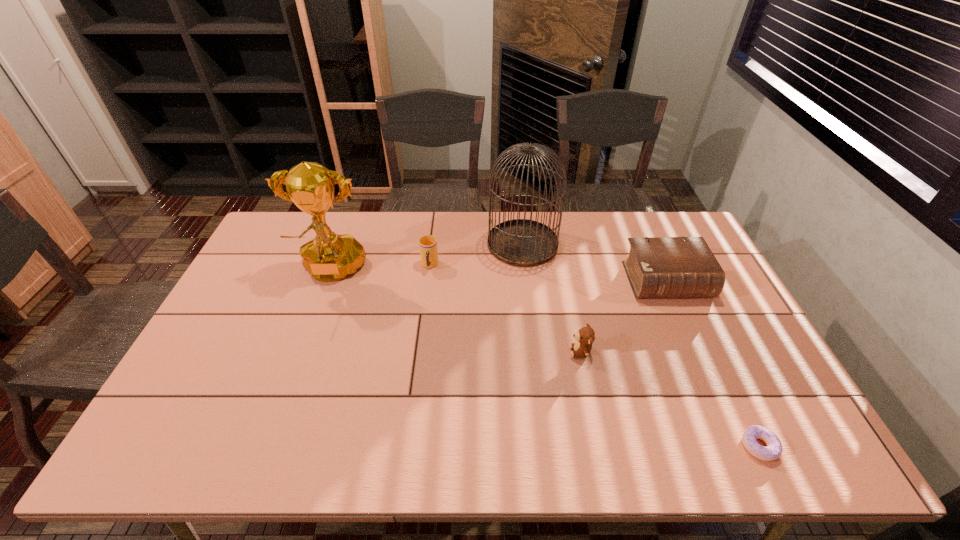
The height and width of the screenshot is (540, 960). Find the location of `vacant area that lies between the teddy bear and the Bible`. vacant area that lies between the teddy bear and the Bible is located at coordinates [623, 316].

Find the location of a particular element. vacant space that's between the birdcage and the cup is located at coordinates (476, 255).

Identify the location of vacant area between the shortest object and the teddy bear. The image size is (960, 540). (670, 399).

Identify the location of free spot between the Bible and the cup. The width and height of the screenshot is (960, 540). (548, 273).

Where is `vacant area that lies between the birdcage and the nearest object`? The width and height of the screenshot is (960, 540). vacant area that lies between the birdcage and the nearest object is located at coordinates (640, 345).

Locate an element on the screen. The height and width of the screenshot is (540, 960). free point between the teddy bear and the cup is located at coordinates (505, 308).

This screenshot has width=960, height=540. I want to click on vacant area that lies between the leftmost object and the teddy bear, so click(x=456, y=312).

This screenshot has width=960, height=540. I want to click on free space that is in between the cup and the teddy bear, so click(505, 308).

Identify the location of object that stands as the second closest to the cup. This screenshot has height=540, width=960. (329, 257).

Locate which object ranks in proximity to the cup. Please provide its 2D coordinates. Your answer should be formatted as a tuple, i.e. [(x, y)], where the tuple contains the x and y coordinates of a point satisfying the conditions above.

[(519, 242)]